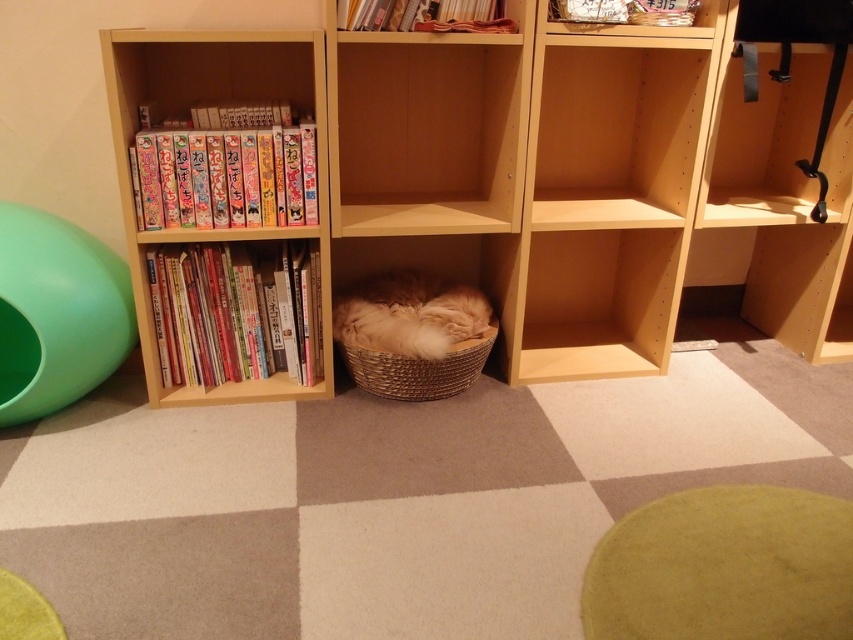
You are a cat owner who wants to place a new toy for your cat. You have a green rubber ball at left and hardcover books at left. Which item is taller and better suited for the cat to play with?

The green rubber ball at left is much taller than the hardcover books at left, making it a better option for the cat to play with due to its height and bounciness.